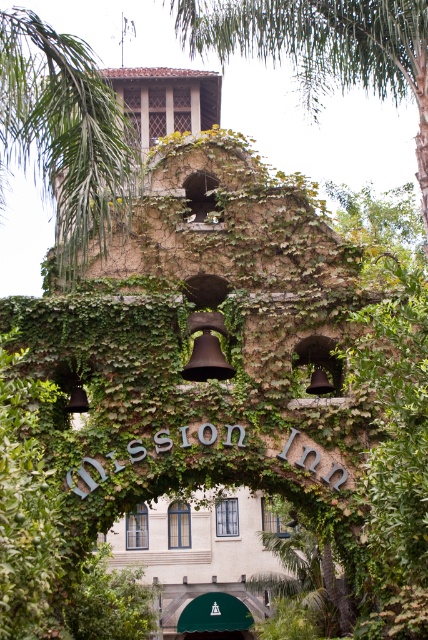
Consider the image. You are standing in front of the Mission Inn bell tower and want to take a photo of the ivy covered structure. If you want to include the green leafy palm tree at upper left in your photo, where should you position the tree in the frame?

The green leafy palm tree at upper left is located at point (x=64, y=131) in the frame, so position it at the upper left corner near those coordinates to include it in the photo.